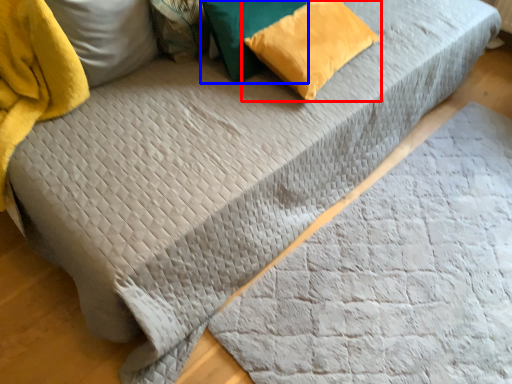
Question: Which object appears farthest to the camera in this image, pillow (highlighted by a red box) or pillow (highlighted by a blue box)?

Choices:
 (A) pillow
 (B) pillow

Answer: (A)